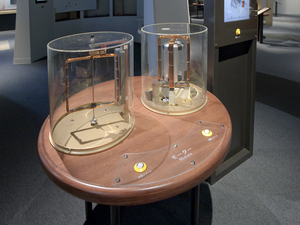
The image size is (300, 225). Find the location of `floor`. floor is located at coordinates (270, 58).